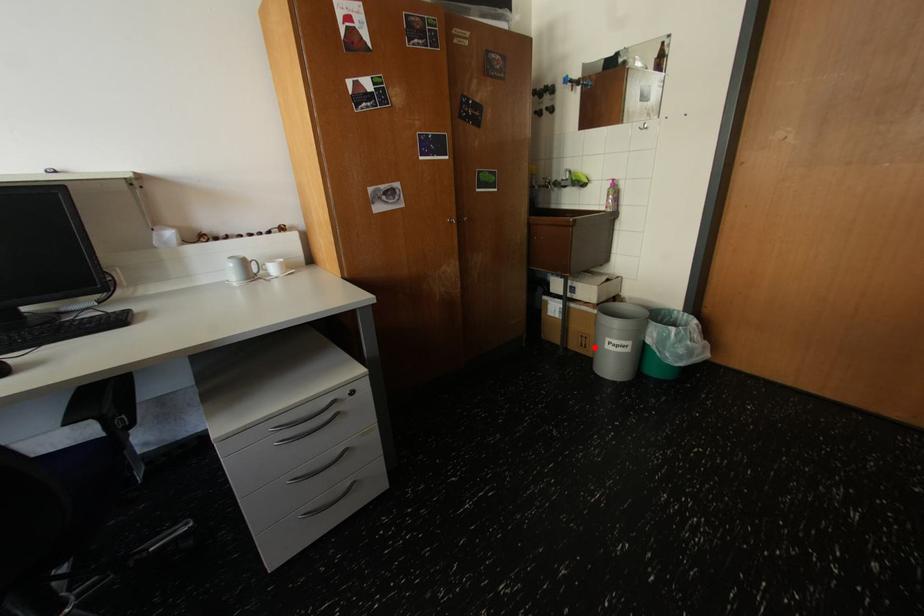
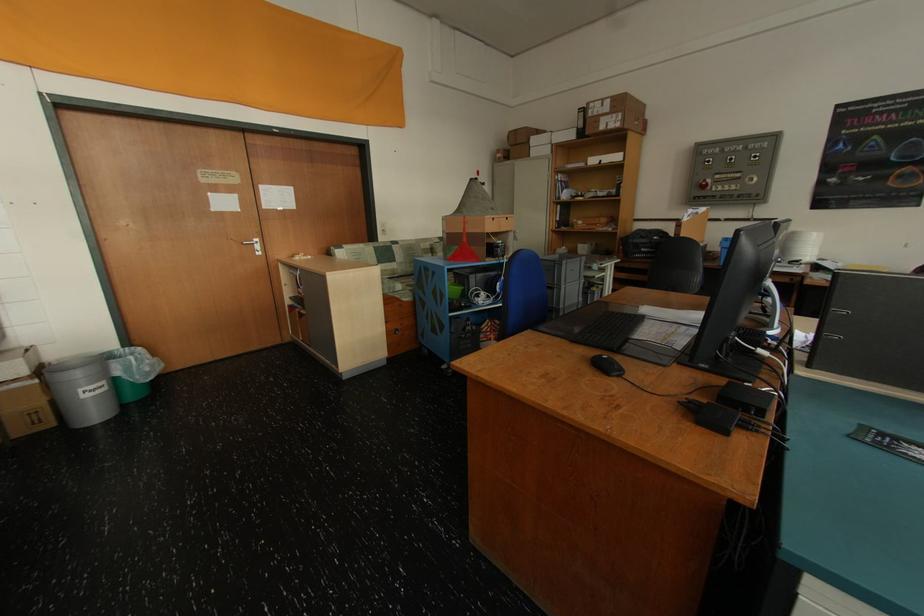
Question: I am providing you with two images of the same scene from different viewpoints. Given a red point in image1, look at the same physical point in image2. Is it:

Choices:
 (A) Closer to the viewpoint
 (B) Farther from the viewpoint

Answer: (B)